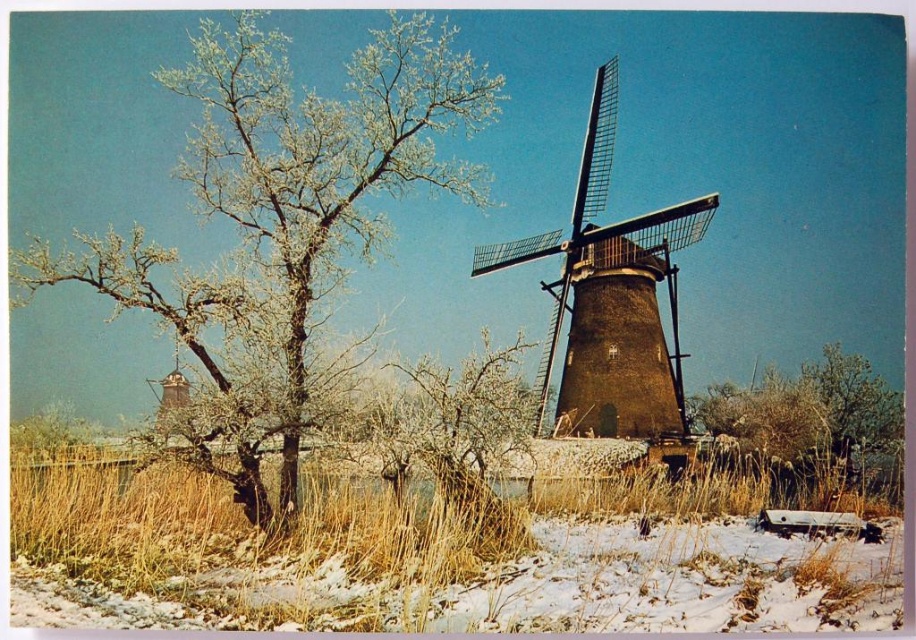
You are an artist planning to paint the winter landscape. You want to ensure the white frosty branches at upper left and brown textured bush at lower right are proportionally accurate. Which object should you paint taller in your artwork?

The white frosty branches at upper left should be painted taller than the brown textured bush at lower right, as it is taller in the scene.

You are a drone operator trying to capture a photo of the brown textured windmill at center. There are white frosty branches at upper left in the way. Can you fly your drone between them and the windmill without getting too close to either? The drone requires at least 2 meters of clearance on all sides.

The white frosty branches at upper left are 21.18 meters away from the brown textured windmill at center. Since the drone needs only 2 meters of clearance, there is sufficient space between them for the drone to safely pass through without getting too close to either object.

You are standing at the point with coordinates point (271, 376) and want to walk towards the point with coordinates point (596, 294). Which direction should you move relative to the windmill?

Since point (271, 376) is in front of point (596, 294), you should move backward towards the windmill to reach your destination.